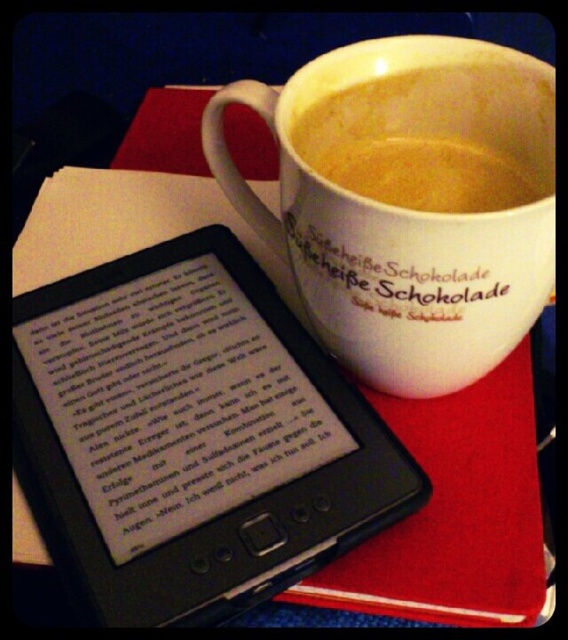
Does black matte tablet computer at upper left have a larger size compared to white matte cup of coffee at upper center?

Correct, black matte tablet computer at upper left is larger in size than white matte cup of coffee at upper center.

In the scene shown: Does black matte tablet computer at upper left appear over white matte cup of coffee at upper center?

No.

Locate an element on the screen. Image resolution: width=568 pixels, height=640 pixels. black matte tablet computer at upper left is located at coordinates (194, 440).

Which is below, white matte mug at upper center or white matte cup of coffee at upper center?

white matte mug at upper center

Image resolution: width=568 pixels, height=640 pixels. I want to click on white matte mug at upper center, so click(x=404, y=209).

Where is `white matte mug at upper center`? white matte mug at upper center is located at coordinates (404, 209).

Who is higher up, black matte tablet computer at upper left or white matte mug at upper center?

white matte mug at upper center is higher up.

You are a GUI agent. You are given a task and a screenshot of the screen. Output one action in this format:
    pyautogui.click(x=<x>, y=<y>)
    Task: Click on the black matte tablet computer at upper left
    Image resolution: width=568 pixels, height=640 pixels.
    Given the screenshot: What is the action you would take?
    pyautogui.click(x=194, y=440)